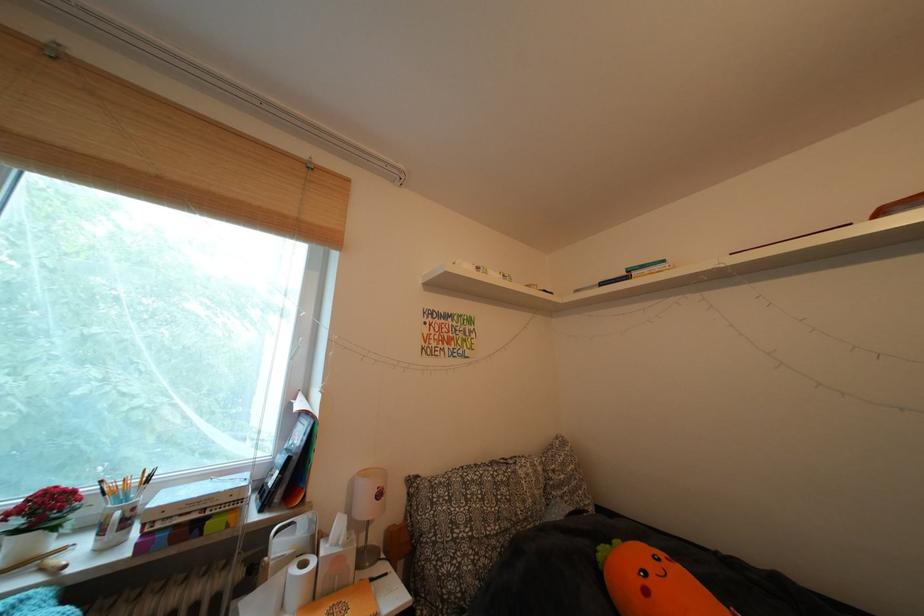
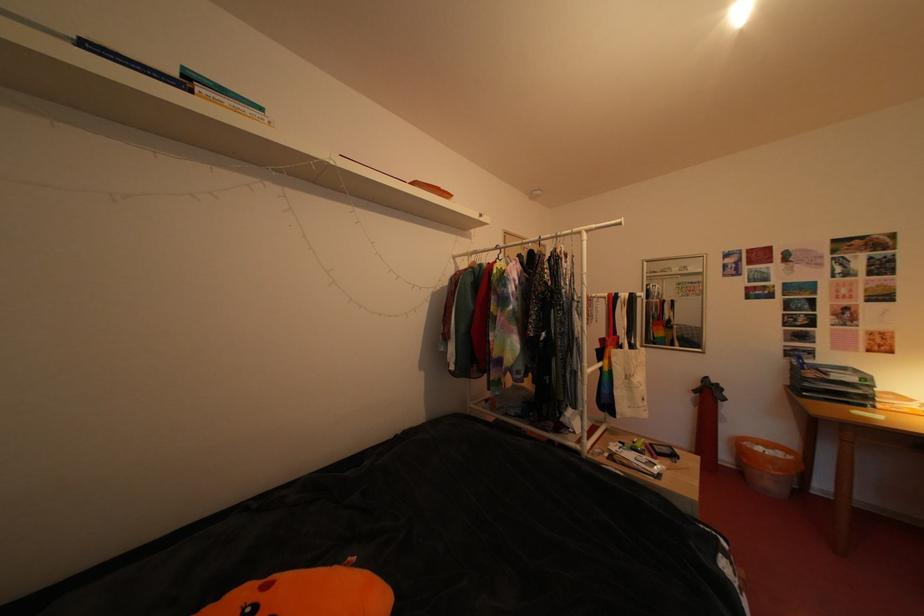
Question: The first image is from the beginning of the video and the second image is from the end. How did the camera likely rotate when shooting the video?

Choices:
 (A) Left
 (B) Right
 (C) Up
 (D) Down

Answer: (B)